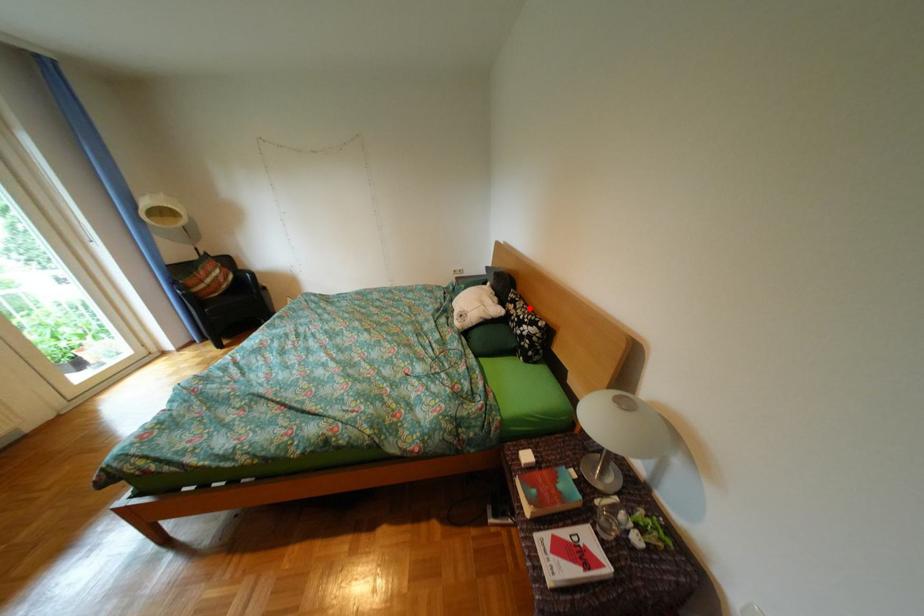
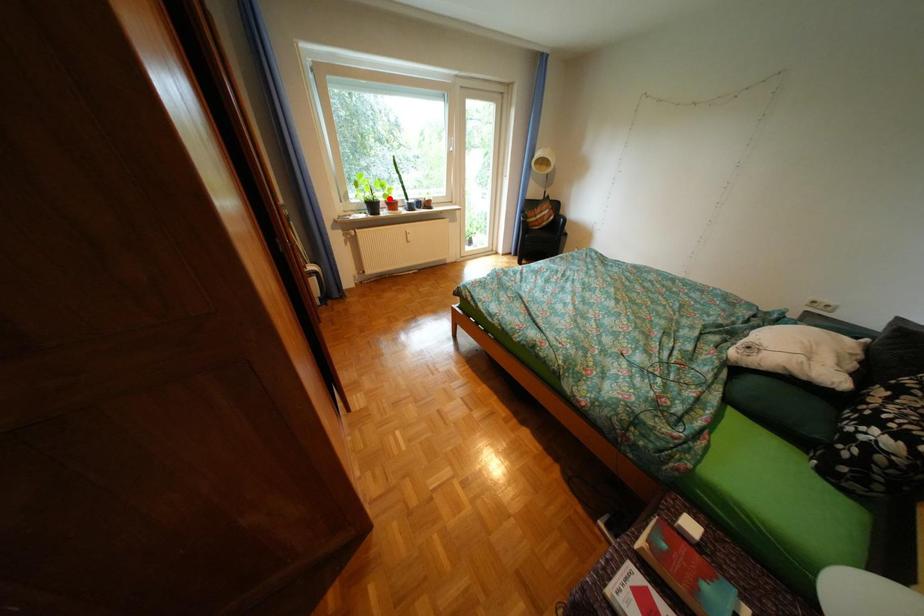
I am providing you with two images of the same scene from different viewpoints. A red point is marked on the first image and another point is marked on the second image. Do the highlighted points in image1 and image2 indicate the same real-world spot?

No